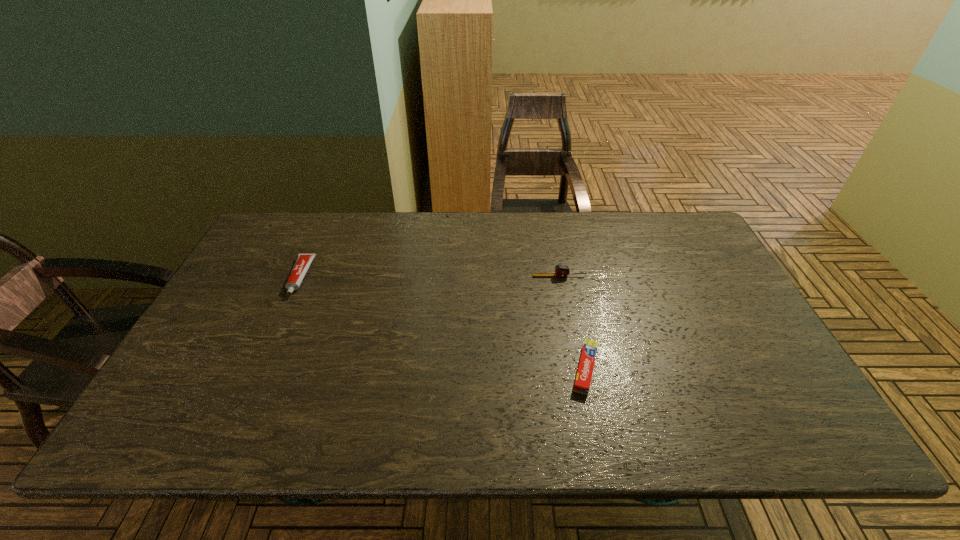
At what (x,y) coordinates should I click in order to perform the action: click on vacant space that satisfies the following two spatial constraints: 1. at the nozzle of the farther toothpaste; 2. on the left side of the nearer toothpaste. Please return your answer as a coordinate pair (x, y). Looking at the image, I should click on (258, 369).

Identify the location of vacant region that satisfies the following two spatial constraints: 1. at the nozzle of the right toothpaste; 2. on the left side of the farther toothpaste. The height and width of the screenshot is (540, 960). (258, 369).